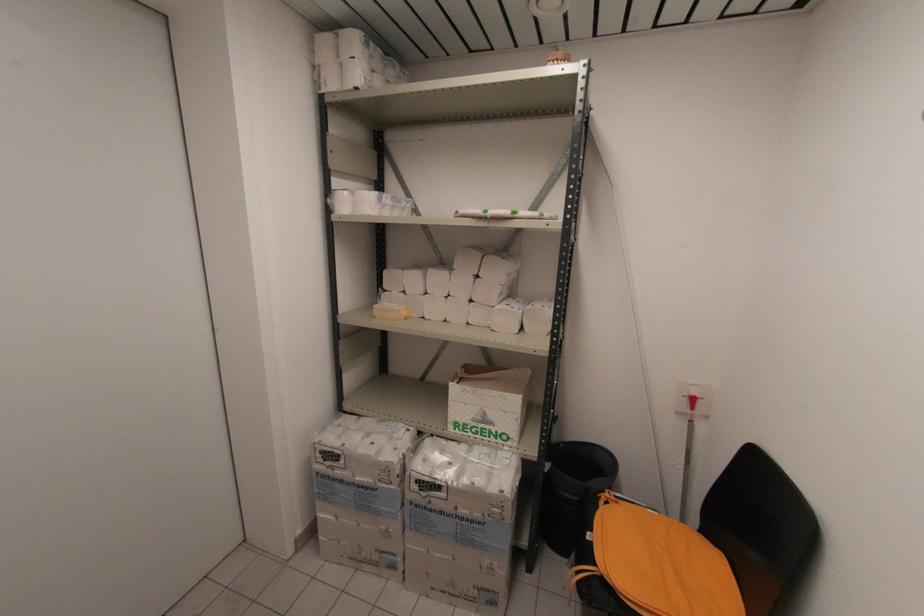
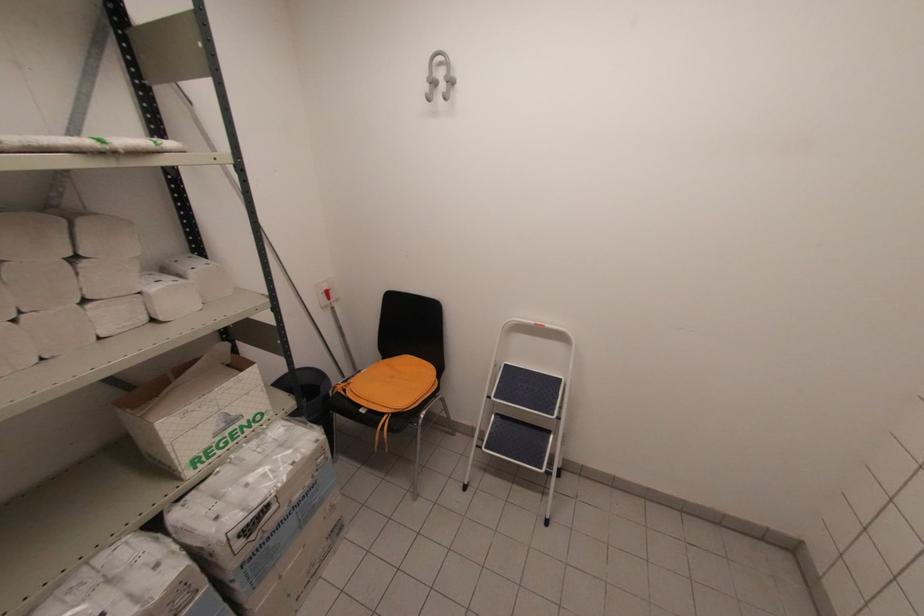
Locate, in the second image, the point that corresponds to point (480, 275) in the first image.

(81, 254)